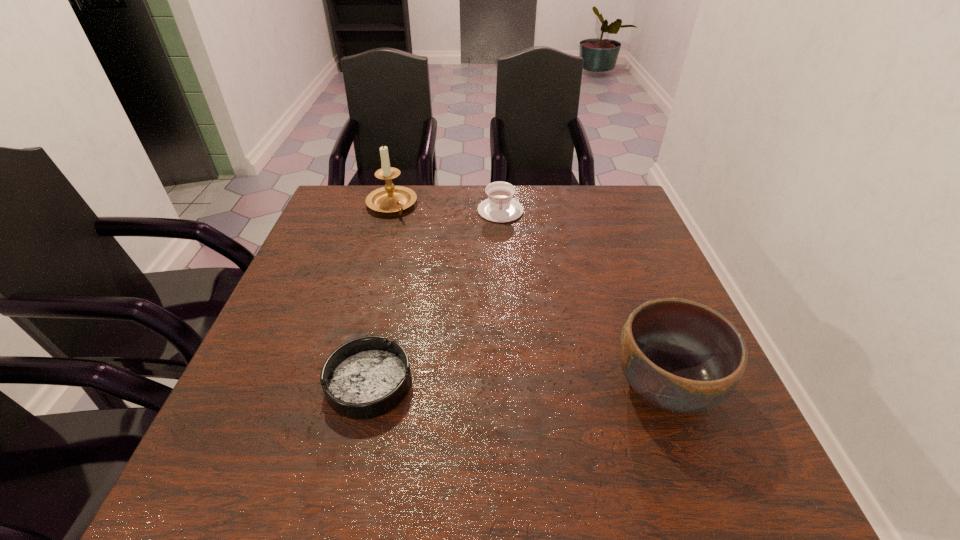
At what (x,y) coordinates should I click in order to perform the action: click on the shortest object. Please return your answer as a coordinate pair (x, y). Image resolution: width=960 pixels, height=540 pixels. Looking at the image, I should click on (364, 378).

Find the location of a particular element. This screenshot has width=960, height=540. the rightmost object is located at coordinates (681, 356).

Find the location of a particular element. This screenshot has width=960, height=540. bowl is located at coordinates (681, 356).

Locate an element on the screen. The height and width of the screenshot is (540, 960). the second shortest object is located at coordinates (500, 207).

Identify the location of teacup. The height and width of the screenshot is (540, 960). (500, 207).

This screenshot has width=960, height=540. Identify the location of candle holder. 390,198.

The height and width of the screenshot is (540, 960). In order to click on vacant space located 0.400m on the right of the ashtray in this screenshot , I will do `click(617, 383)`.

Where is `vacant space located 0.180m on the back of the bowl`? The width and height of the screenshot is (960, 540). vacant space located 0.180m on the back of the bowl is located at coordinates (628, 287).

The height and width of the screenshot is (540, 960). What are the coordinates of `vacant space situated on the handle side of the teacup` in the screenshot? It's located at (507, 313).

This screenshot has height=540, width=960. What are the coordinates of `free location located 0.300m on the handle side of the teacup` in the screenshot? It's located at (506, 295).